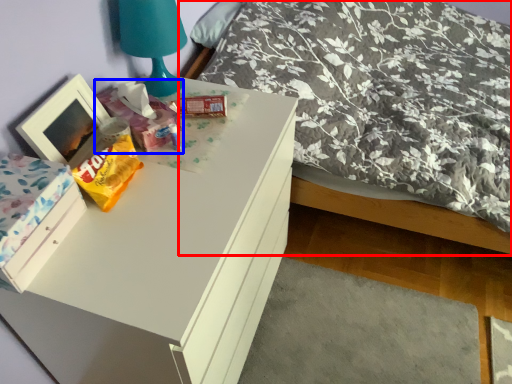
Question: Which point is further to the camera, bed (highlighted by a red box) or package (highlighted by a blue box)?

Choices:
 (A) bed
 (B) package

Answer: (B)